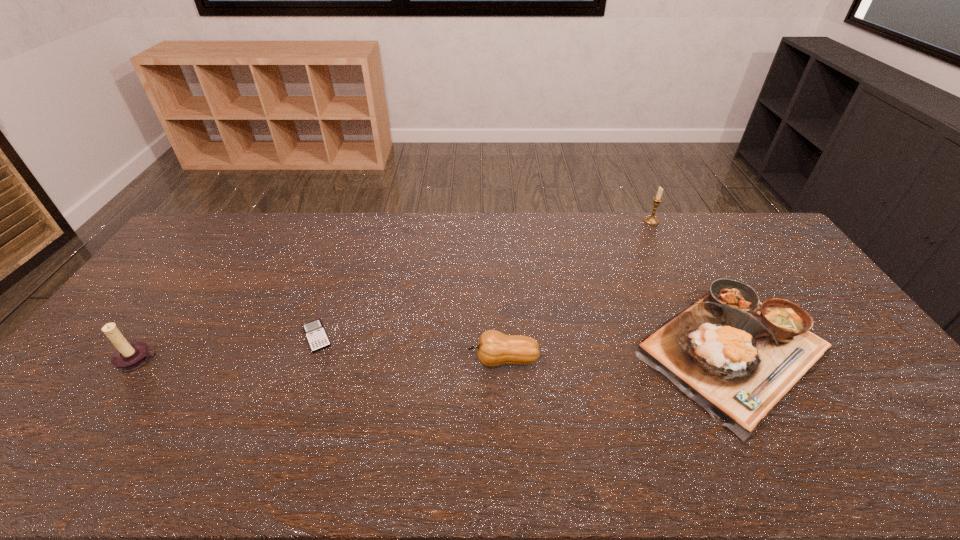
Locate an element on the screen. This screenshot has height=540, width=960. the farther candle holder is located at coordinates (650, 220).

Where is `the farthest object`? Image resolution: width=960 pixels, height=540 pixels. the farthest object is located at coordinates (650, 220).

The width and height of the screenshot is (960, 540). In order to click on the nearer candle holder in this screenshot , I will do `click(128, 356)`.

Where is `the left candle holder`? the left candle holder is located at coordinates (128, 356).

Where is `the third object from left to right`? The height and width of the screenshot is (540, 960). the third object from left to right is located at coordinates (494, 348).

Locate an element on the screen. The height and width of the screenshot is (540, 960). platter is located at coordinates (736, 357).

I want to click on the fourth object from right to left, so click(x=317, y=338).

Locate an element on the screen. The width and height of the screenshot is (960, 540). the shortest object is located at coordinates (317, 338).

This screenshot has height=540, width=960. What are the coordinates of `vacant region located 0.140m on the front of the right candle holder` in the screenshot? It's located at 664,248.

The height and width of the screenshot is (540, 960). In order to click on vacant region located on the wick of the leftmost object in this screenshot , I will do `click(116, 393)`.